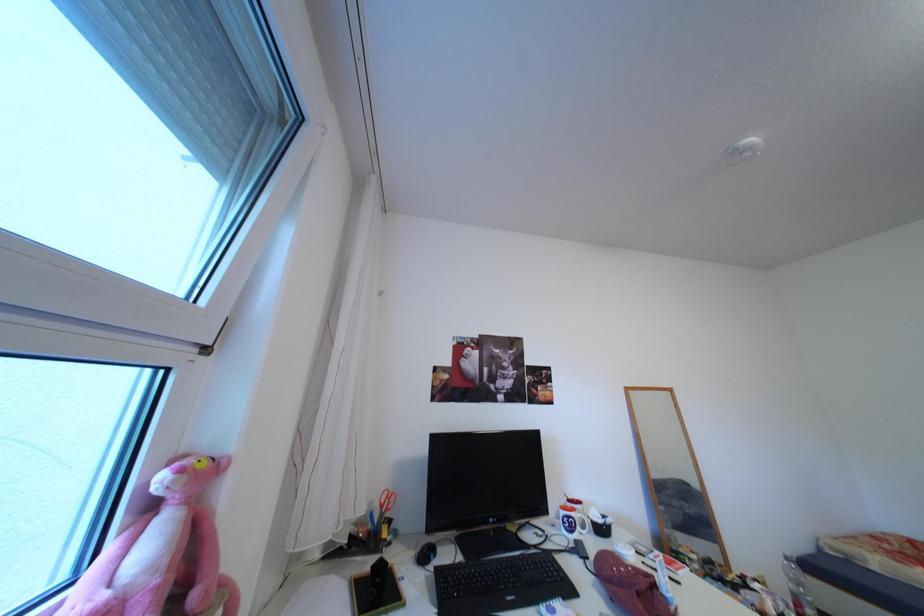
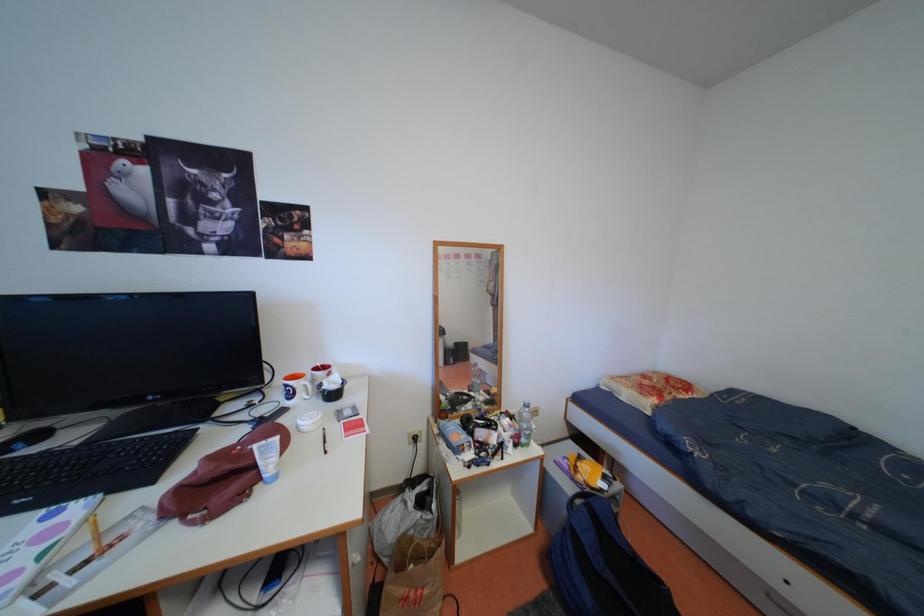
Which direction would the cameraman need to move to produce the second image?

The cameraman moved toward right, forward.